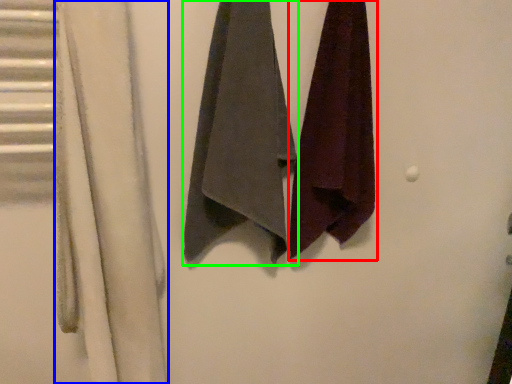
Question: Which object is the farthest from towel (highlighted by a red box)? Choose among these: curtain (highlighted by a blue box) or towel (highlighted by a green box).

Choices:
 (A) curtain
 (B) towel

Answer: (A)